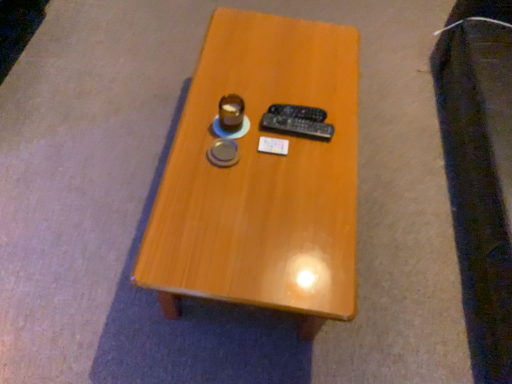
At what (x,y) coordinates should I click in order to perform the action: click on free space behind black plastic remote control at center, arranged as the 1th remote control when viewed from the back. Please return your answer as a coordinate pair (x, y). Looking at the image, I should click on (295, 78).